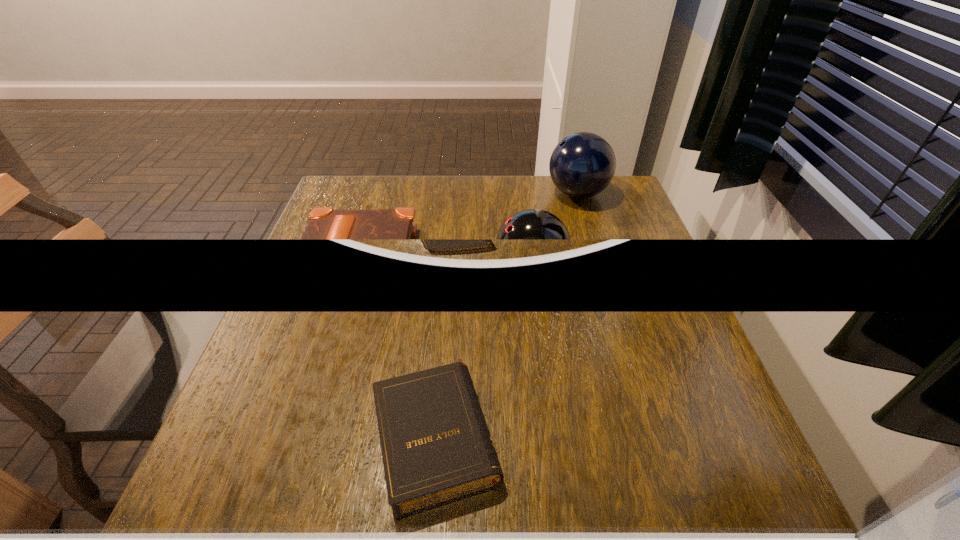
The height and width of the screenshot is (540, 960). I want to click on free region at the near right corner of the desktop, so click(732, 498).

The image size is (960, 540). Identify the location of free space that is in between the Bible and the farther bowling ball. 472,225.

You are a GUI agent. You are given a task and a screenshot of the screen. Output one action in this format:
    pyautogui.click(x=<x>, y=<y>)
    Task: Click on the vacant area between the Bible and the farthest object
    The width and height of the screenshot is (960, 540).
    Given the screenshot: What is the action you would take?
    pyautogui.click(x=472, y=225)

You are a GUI agent. You are given a task and a screenshot of the screen. Output one action in this format:
    pyautogui.click(x=<x>, y=<y>)
    Task: Click on the vacant point located between the farther bowling ball and the shortest object
    
    Given the screenshot: What is the action you would take?
    pyautogui.click(x=472, y=225)

I want to click on free space between the shortest object and the farthest object, so click(472, 225).

This screenshot has height=540, width=960. Find the location of `the second closest object to the shortest object`. the second closest object to the shortest object is located at coordinates (582, 165).

The height and width of the screenshot is (540, 960). I want to click on the second closest object to the nearer bowling ball, so click(x=582, y=165).

Find the location of a particular element. The width and height of the screenshot is (960, 540). vacant space that satisfies the following two spatial constraints: 1. on the surface of the farther bowling ball near the finger holes; 2. on the spine side of the shortest object is located at coordinates (595, 255).